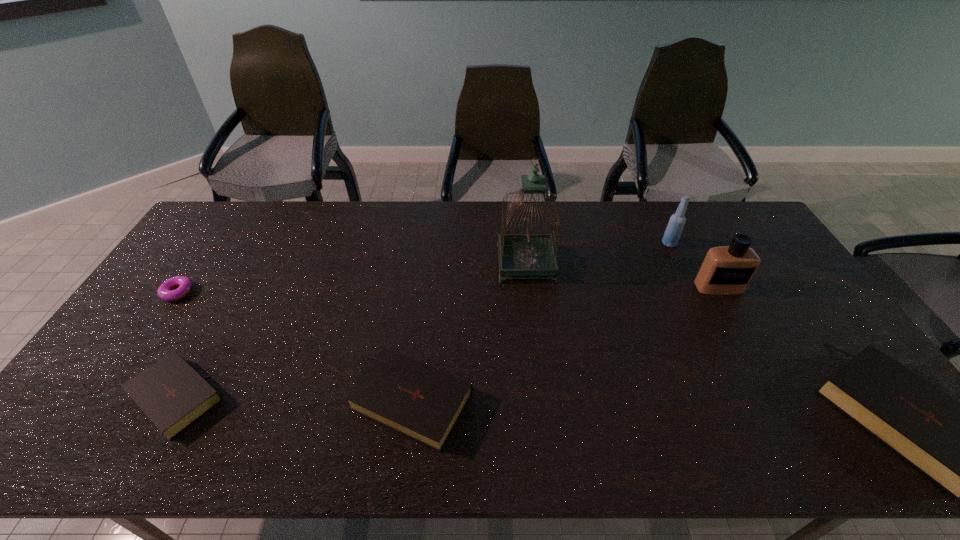
Identify the location of the sixth tallest object. This screenshot has width=960, height=540. (173, 395).

Find the location of a particular element. This screenshot has width=960, height=540. the shortest Bible is located at coordinates (173, 395).

The height and width of the screenshot is (540, 960). I want to click on the second tallest Bible, so click(x=421, y=402).

This screenshot has height=540, width=960. Find the location of `the fifth object from right to left`. the fifth object from right to left is located at coordinates (421, 402).

This screenshot has width=960, height=540. In order to click on bottle in this screenshot , I will do `click(673, 231)`.

Identify the location of the tallest object. (528, 254).

This screenshot has height=540, width=960. Identify the location of the fourth object from right to left. 528,254.

This screenshot has height=540, width=960. What are the coordinates of `perfume` in the screenshot? It's located at (726, 270).

This screenshot has width=960, height=540. I want to click on the leftmost object, so click(x=165, y=291).

Where is `the shortest object`? Image resolution: width=960 pixels, height=540 pixels. the shortest object is located at coordinates (165, 291).